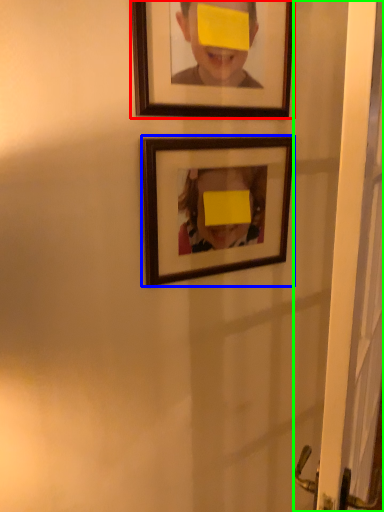
Question: Estimate the real-world distances between objects in this image. Which object is closer to picture frame (highlighted by a red box), picture frame (highlighted by a blue box) or screen door (highlighted by a green box)?

Choices:
 (A) picture frame
 (B) screen door

Answer: (A)